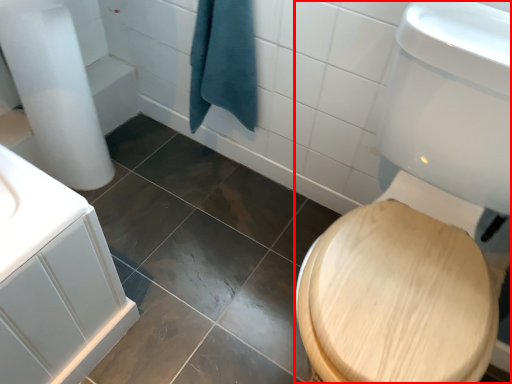
Question: From the image, what is the correct spatial relationship of toilet bowl (annotated by the red box) in relation to bath towel?

Choices:
 (A) right
 (B) left

Answer: (A)